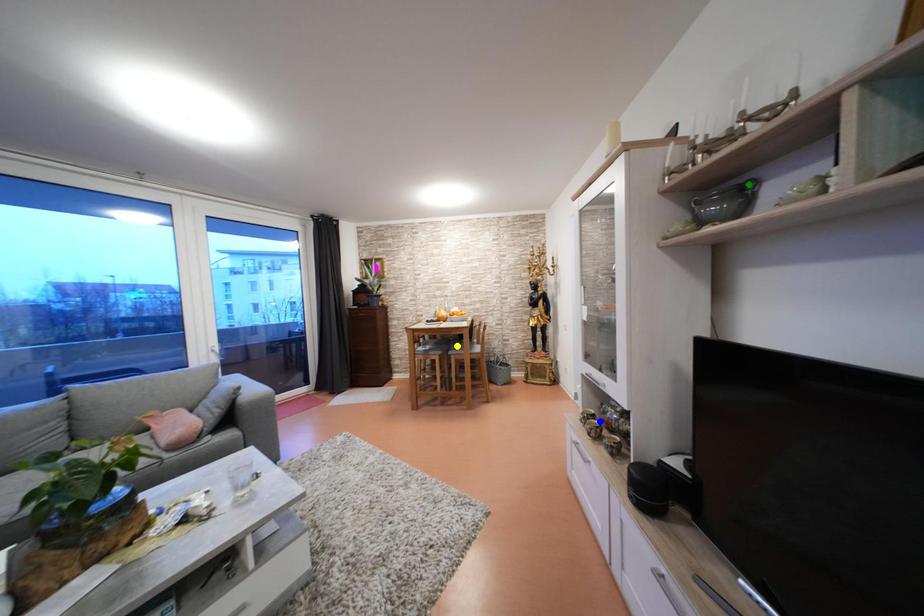
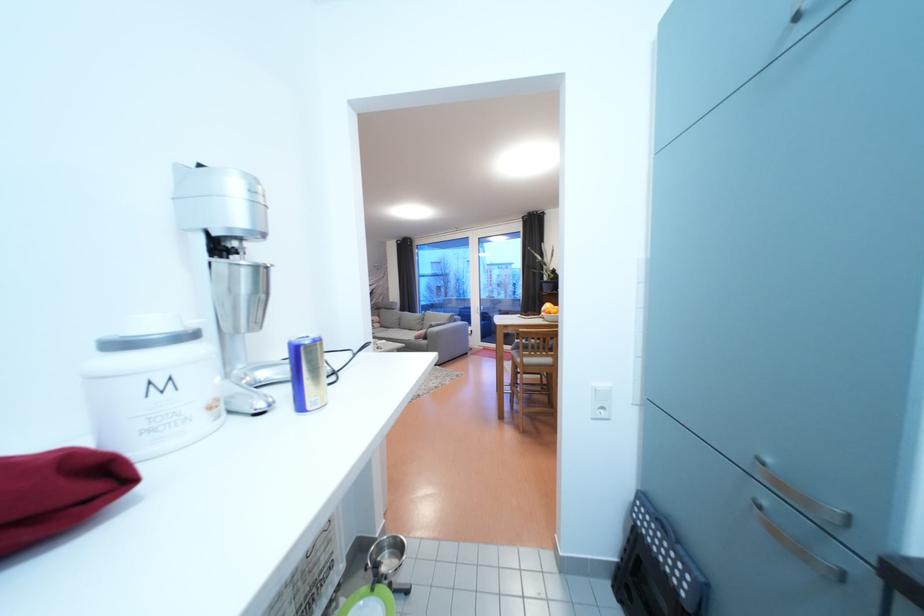
I am providing you with two images of the same scene from different viewpoints. Three points are marked in image1. Which point corresponds to a part or object that is occluded in image2?In image1, three points are marked. Which of them correspond to a part or object that is occluded in image2?Among the three points shown in image1, which one corresponds to a part or object that is no longer visible due to occlusion in image2?

green point, blue point, yellow point